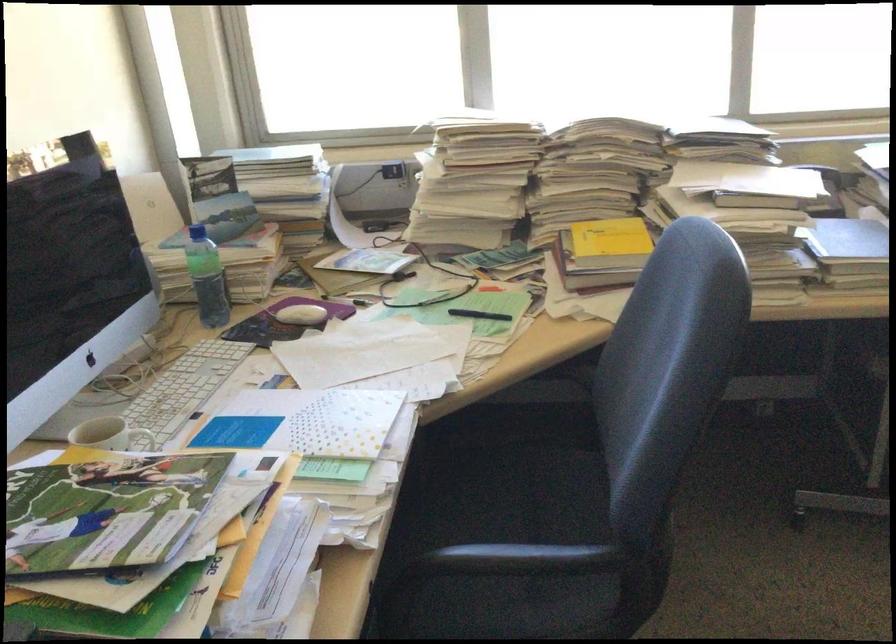
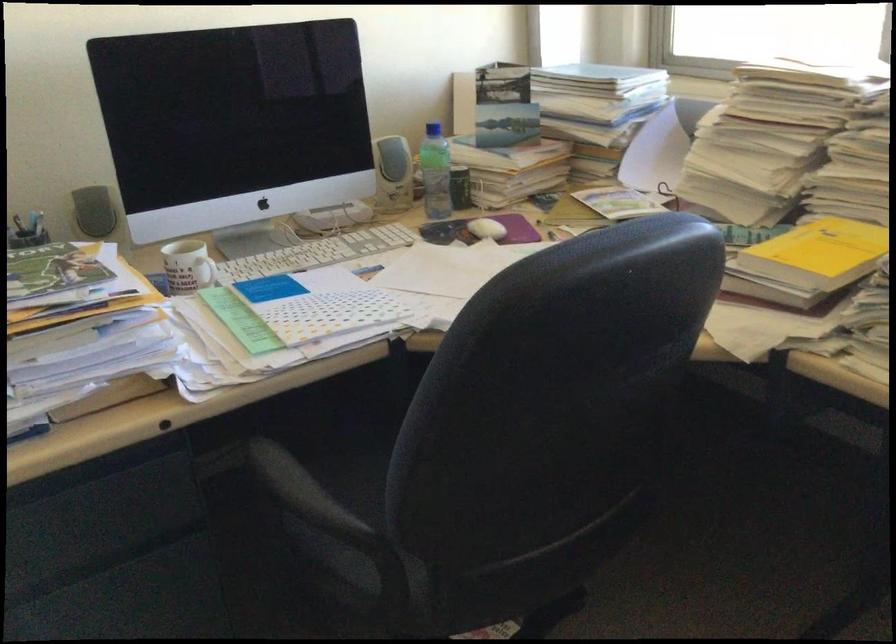
Find the pixel in the second image that matches point (622, 242) in the first image.

(819, 252)